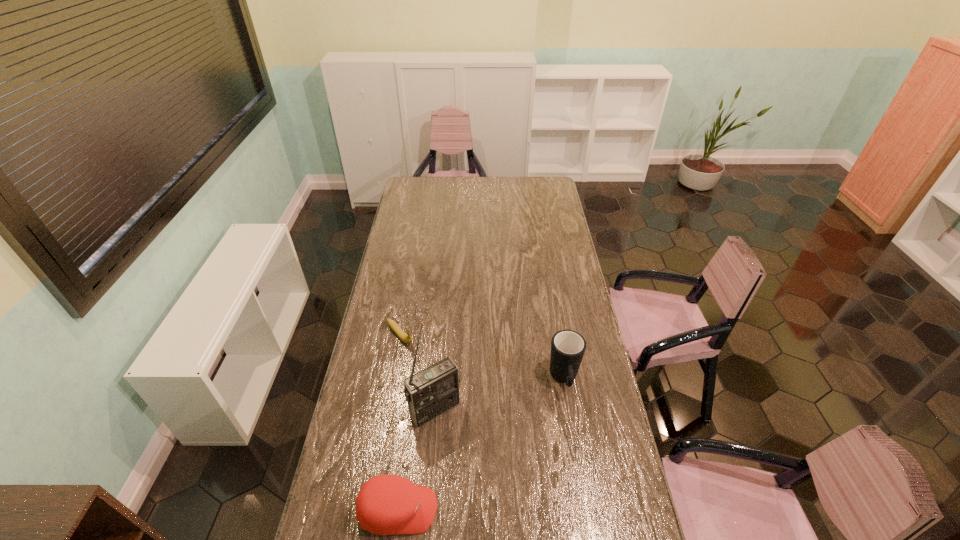
Find the location of a particular element. The image size is (960, 540). vacant space on the desktop that is between the nearest object and the second tallest object and is positioned on the display of the radio receiver is located at coordinates (467, 455).

This screenshot has height=540, width=960. In order to click on free space on the desktop that is between the cap and the rightmost object and is positioned at the stem of the banana in this screenshot , I will do `click(493, 435)`.